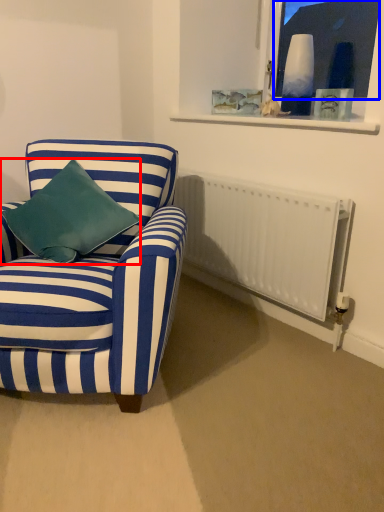
Question: Which object appears farthest to the camera in this image, pillow (highlighted by a red box) or window screen (highlighted by a blue box)?

Choices:
 (A) pillow
 (B) window screen

Answer: (B)